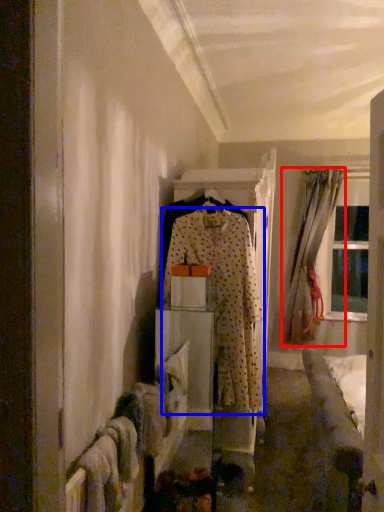
Question: Which of the following is the closest to the observer, curtain (highlighted by a red box) or fancy dress (highlighted by a blue box)?

Choices:
 (A) curtain
 (B) fancy dress

Answer: (B)